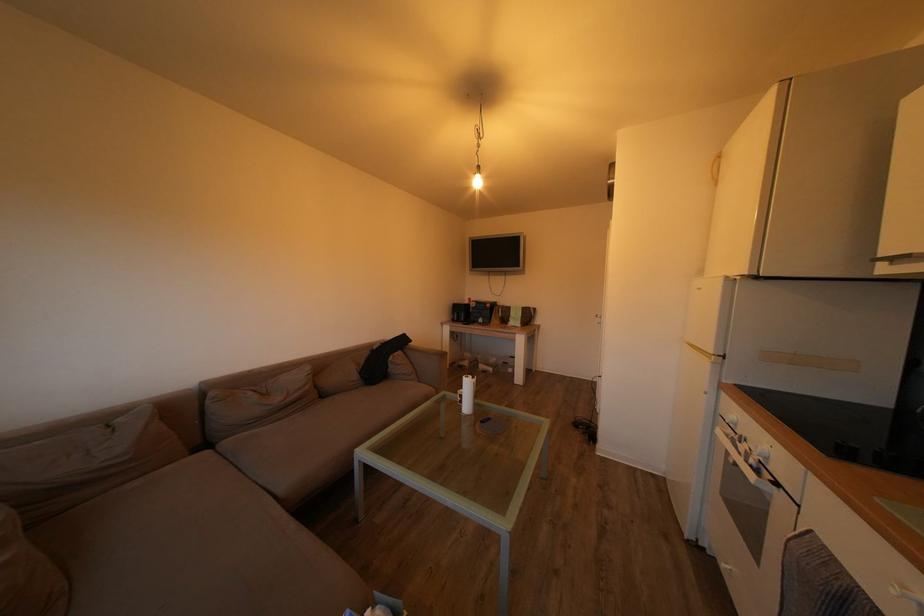
Image resolution: width=924 pixels, height=616 pixels. I want to click on brown refrigerator handle, so click(714, 168).